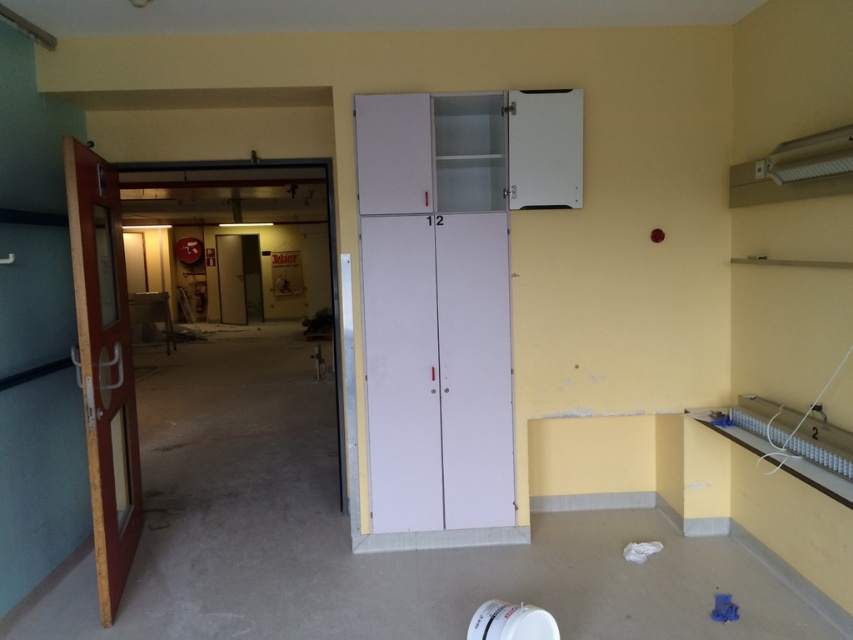
Question: Does white matte cabinet at center appear on the left side of wooden glass door at left?

Choices:
 (A) no
 (B) yes

Answer: (A)

Question: Can you confirm if white matte cabinet at center is positioned to the right of wooden glass door at left?

Choices:
 (A) no
 (B) yes

Answer: (B)

Question: Does white matte cabinet at center have a greater width compared to wooden glass door at left?

Choices:
 (A) no
 (B) yes

Answer: (B)

Question: Which object is closer to the camera taking this photo?

Choices:
 (A) white matte cabinet at center
 (B) wooden glass door at left

Answer: (B)

Question: Which point is farther from the camera taking this photo?

Choices:
 (A) (482, 472)
 (B) (125, 339)

Answer: (B)